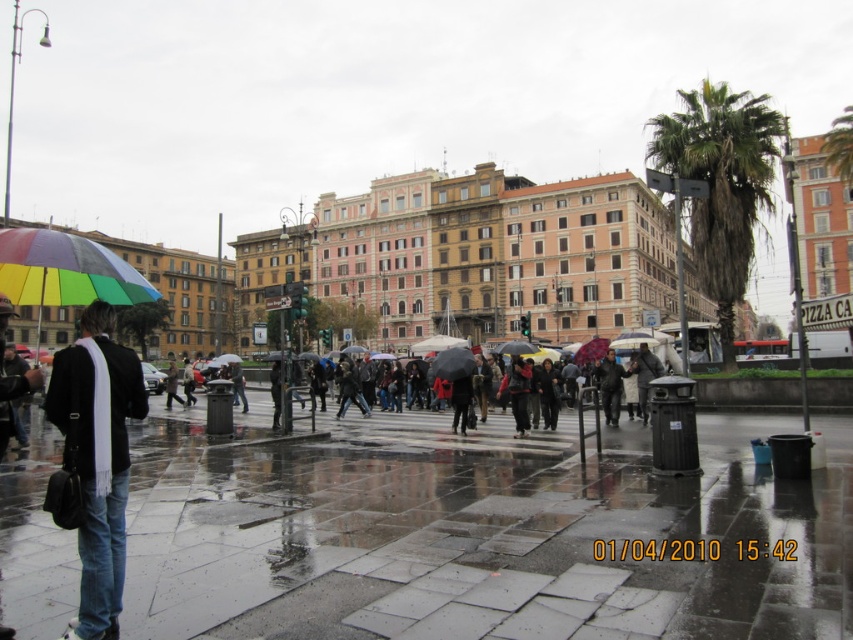
Question: Which point is closer to the camera taking this photo?

Choices:
 (A) (199, 602)
 (B) (120, 368)
 (C) (471, 365)

Answer: (A)

Question: Among these points, which one is farthest from the camera?

Choices:
 (A) (373, 422)
 (B) (459, 364)

Answer: (A)

Question: Which object is positioned farthest from the rainbow fabric umbrella at center?

Choices:
 (A) shiny concrete pavement at center
 (B) brown leather coat at center
 (C) rainbow umbrella at center

Answer: (B)

Question: Does shiny concrete pavement at center have a lesser width compared to brown leather coat at center?

Choices:
 (A) no
 (B) yes

Answer: (A)

Question: Does shiny concrete pavement at center have a greater width compared to rainbow fabric umbrella at left?

Choices:
 (A) yes
 (B) no

Answer: (A)

Question: Does rainbow umbrella at center lie behind rainbow fabric umbrella at center?

Choices:
 (A) yes
 (B) no

Answer: (B)